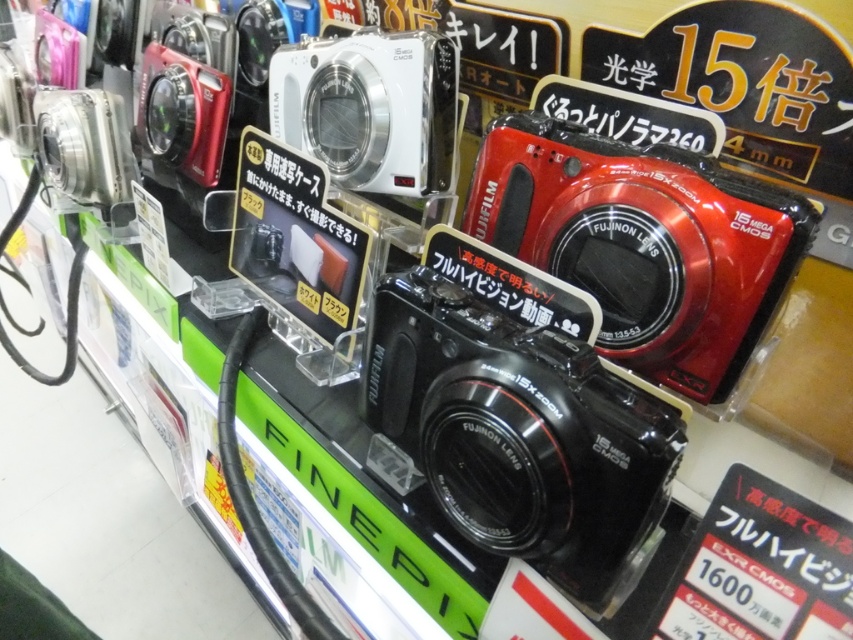
Question: Can you confirm if black plastic camera at center is positioned to the right of white plastic camera at upper center?

Choices:
 (A) no
 (B) yes

Answer: (B)

Question: Which of these objects is positioned closest to the satin silver camera at left?

Choices:
 (A) white plastic camera at upper center
 (B) shiny red plastic camera at upper right
 (C) black plastic camera at center

Answer: (A)

Question: Among these points, which one is nearest to the camera?

Choices:
 (A) (544, 124)
 (B) (485, 508)

Answer: (B)

Question: Does shiny red plastic camera at upper right appear over matte black camera at upper left?

Choices:
 (A) yes
 (B) no

Answer: (B)

Question: Does black plastic camera at center come in front of shiny red plastic camera at upper right?

Choices:
 (A) no
 (B) yes

Answer: (B)

Question: Based on their relative distances, which object is nearer to the satin silver camera at left?

Choices:
 (A) white plastic camera at upper center
 (B) black plastic camera at center

Answer: (A)